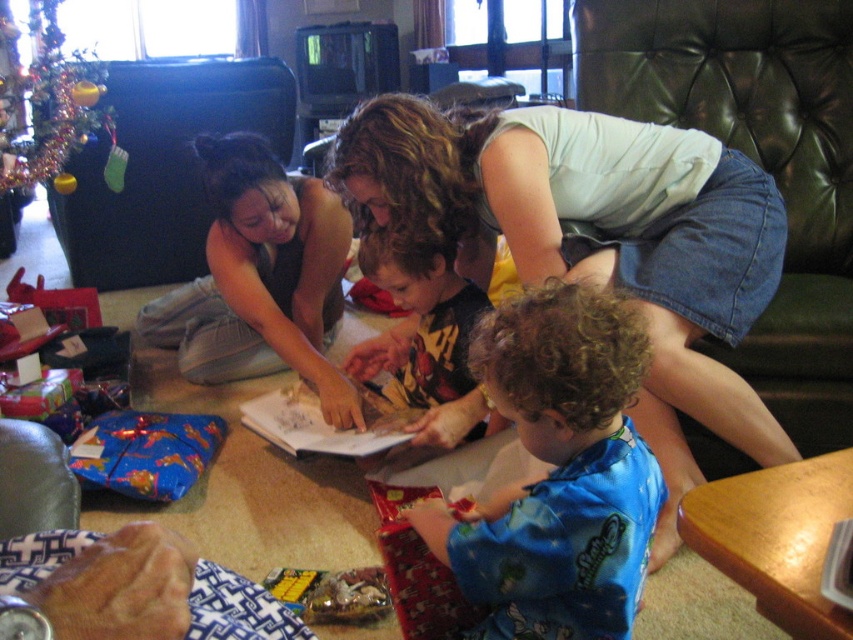
Question: Which of the following is the farthest from the observer?

Choices:
 (A) matte black shirt at center
 (B) denim skirt at center

Answer: (A)

Question: Which point is farther to the camera?

Choices:
 (A) (299, 252)
 (B) (373, 161)

Answer: (A)

Question: Where is denim skirt at center located in relation to blue satin pajamas at lower center in the image?

Choices:
 (A) right
 (B) left

Answer: (A)

Question: Is denim skirt at center below blue satin pajamas at lower center?

Choices:
 (A) yes
 (B) no

Answer: (B)

Question: Estimate the real-world distances between objects in this image. Which object is farther from the matte black shirt at center?

Choices:
 (A) blue satin pajamas at lower center
 (B) denim skirt at center
 (C) yellow printed shirt at center

Answer: (A)

Question: Does denim skirt at center appear under yellow printed shirt at center?

Choices:
 (A) no
 (B) yes

Answer: (A)